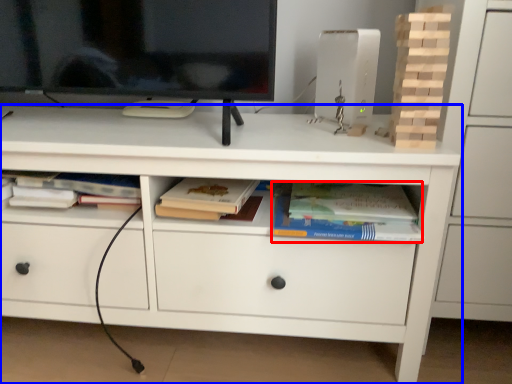
Question: Which object appears closest to the camera in this image, paperback book (highlighted by a red box) or chest of drawers (highlighted by a blue box)?

Choices:
 (A) paperback book
 (B) chest of drawers

Answer: (B)